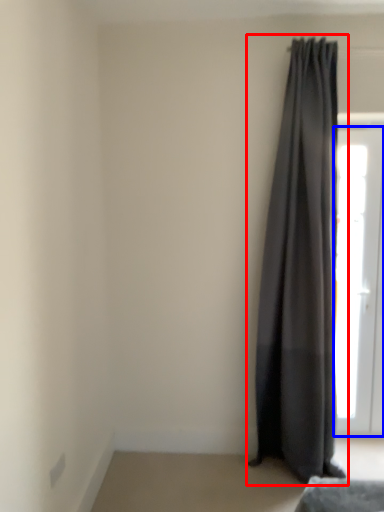
Question: Among these objects, which one is nearest to the camera, curtain (highlighted by a red box) or door (highlighted by a blue box)?

Choices:
 (A) curtain
 (B) door

Answer: (A)